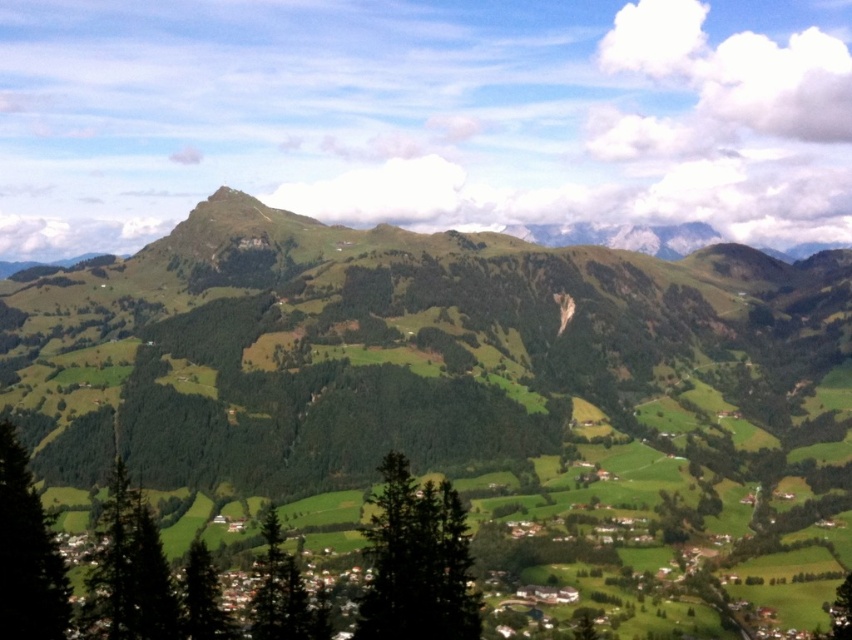
You are a GUI agent. You are given a task and a screenshot of the screen. Output one action in this format:
    pyautogui.click(x=<x>, y=<y>)
    Task: Click on the green matte tree at center
    This screenshot has width=852, height=640.
    Given the screenshot: What is the action you would take?
    pyautogui.click(x=283, y=593)

Between green matte tree at center and green matte tree at lower center, which one appears on the right side from the viewer's perspective?

From the viewer's perspective, green matte tree at center appears more on the right side.

The image size is (852, 640). Describe the element at coordinates (283, 593) in the screenshot. I see `green matte tree at center` at that location.

The image size is (852, 640). I want to click on green matte tree at center, so click(x=283, y=593).

Does green grassy mountain range at center appear under green matte tree at lower center?

No, green grassy mountain range at center is not below green matte tree at lower center.

Is point (320, 304) in front of point (211, 572)?

That is False.

Locate an element on the screen. green grassy mountain range at center is located at coordinates (412, 353).

Does green textured tree at center appear on the right side of green matte tree at lower center?

Yes, green textured tree at center is to the right of green matte tree at lower center.

Who is more distant from viewer, (455, 577) or (223, 625)?

The point (223, 625) is behind.

You are a GUI agent. You are given a task and a screenshot of the screen. Output one action in this format:
    pyautogui.click(x=<x>, y=<y>)
    Task: Click on the green textured tree at center
    The height and width of the screenshot is (640, 852).
    Given the screenshot: What is the action you would take?
    pyautogui.click(x=417, y=563)